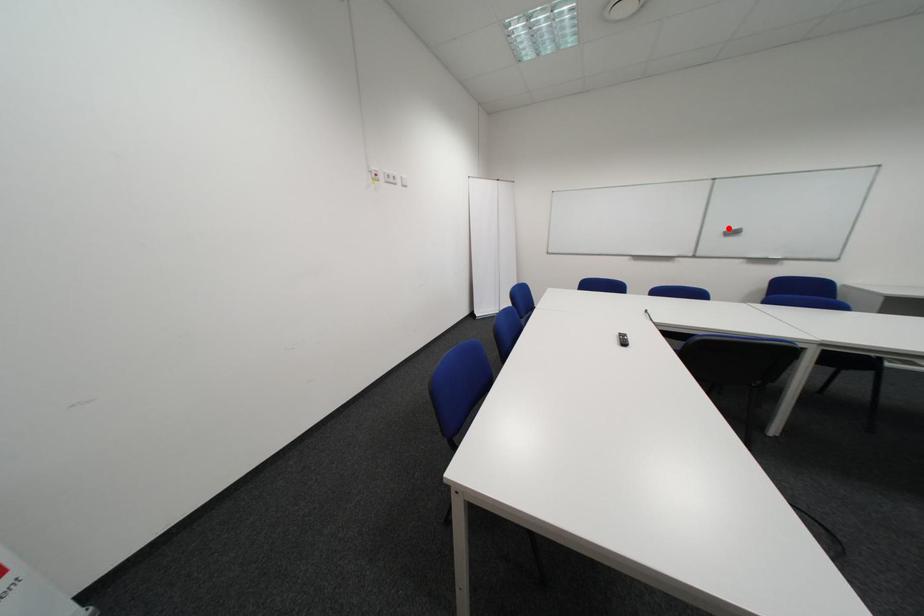
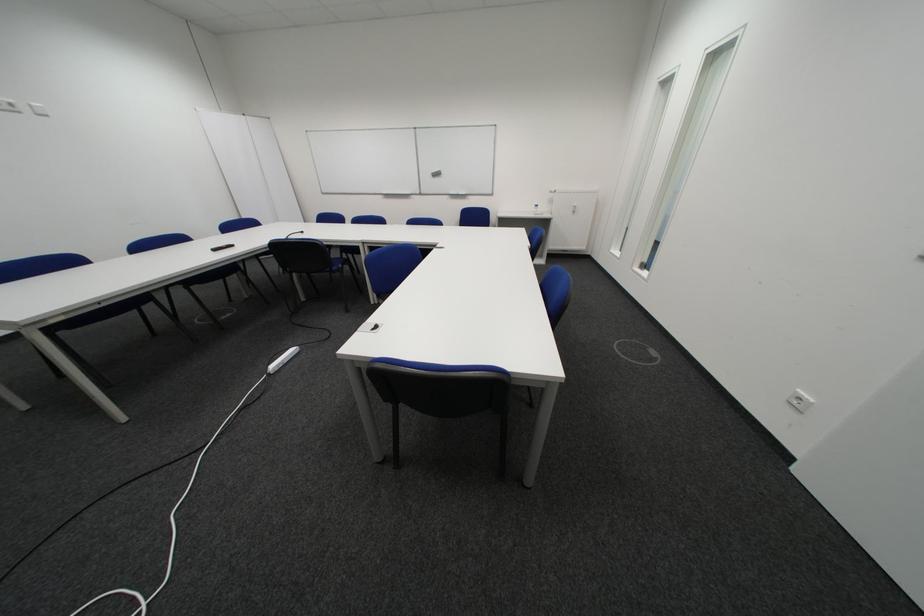
Find the pixel in the second image that matches the highlighted location in the first image.

(440, 171)